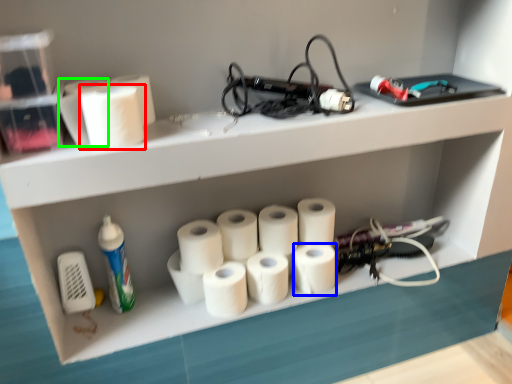
Question: Which is farther away from paper towel (highlighted by a red box)? paper towel (highlighted by a blue box) or toilet paper (highlighted by a green box)?

Choices:
 (A) paper towel
 (B) toilet paper

Answer: (A)